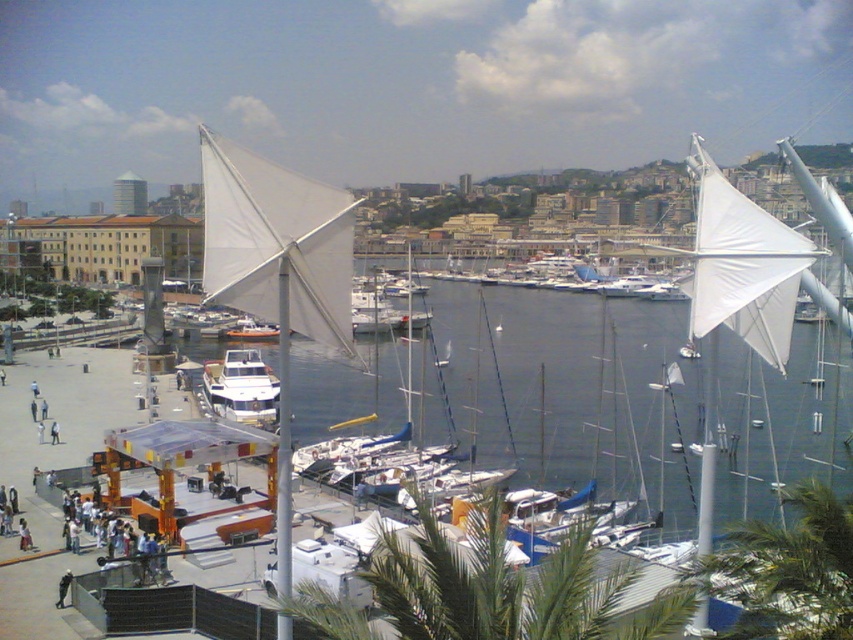
Can you confirm if green leafy palm tree at lower center is positioned above white fabric sail at upper right?

No, green leafy palm tree at lower center is not above white fabric sail at upper right.

Who is more distant from viewer, (660,611) or (766,289)?

Positioned behind is point (766,289).

This screenshot has width=853, height=640. Identify the location of green leafy palm tree at lower center. (508, 586).

Who is more distant from viewer, [792,586] or [259,413]?

The point [259,413] is more distant.

Between green leafy palm tree at lower right and white glossy boat at center, which one is positioned lower?

green leafy palm tree at lower right is lower down.

Who is more distant from viewer, (721,561) or (213,390)?

The point (213,390) is behind.

You are a GUI agent. You are given a task and a screenshot of the screen. Output one action in this format:
    pyautogui.click(x=<x>, y=<y>)
    Task: Click on the green leafy palm tree at lower right
    
    Given the screenshot: What is the action you would take?
    pyautogui.click(x=788, y=572)

Does point (750, 620) come closer to viewer compared to point (247, 337)?

Yes, it is.

Who is more forward, (851,586) or (247,326)?

Point (851,586) is in front.

Image resolution: width=853 pixels, height=640 pixels. Identify the location of green leafy palm tree at lower right. (788, 572).

What are the coordinates of `green leafy palm tree at lower right` in the screenshot? It's located at (788, 572).